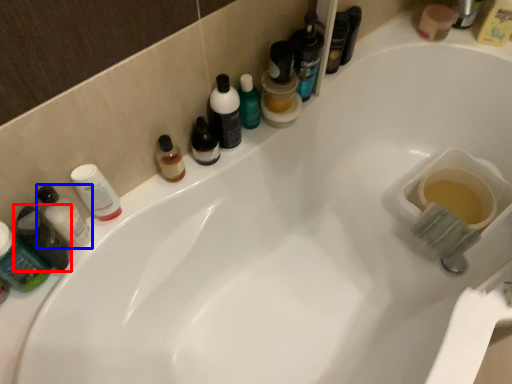
Question: Among these objects, which one is farthest to the camera, toiletry (highlighted by a red box) or toiletry (highlighted by a blue box)?

Choices:
 (A) toiletry
 (B) toiletry

Answer: (B)